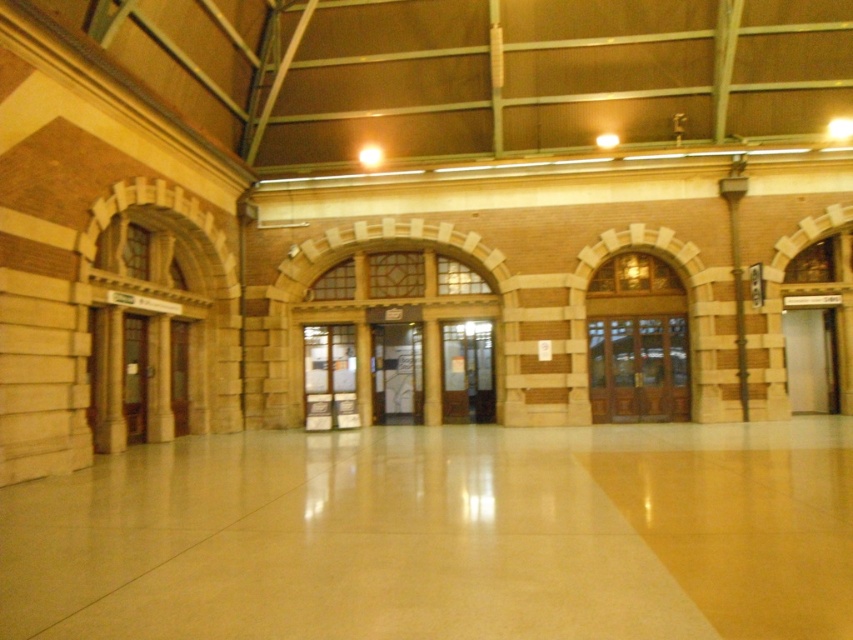
Is satin silver door at right in front of wooden door at left?

No, it is not.

Does satin silver door at right appear on the right side of wooden door at left?

Correct, you'll find satin silver door at right to the right of wooden door at left.

Which is behind, point (782, 310) or point (142, 346)?

The point (782, 310) is more distant.

Where is `satin silver door at right`? The image size is (853, 640). satin silver door at right is located at coordinates (810, 358).

Does wooden door at center have a lesser width compared to transparent glass door at center?

Yes.

Can you confirm if wooden door at center is wider than transparent glass door at center?

No.

Is point (468, 378) closer to viewer compared to point (404, 340)?

Yes, it is in front of point (404, 340).

Identify the location of wooden door at center. The image size is (853, 640). (467, 371).

Can you confirm if satin silver door at right is smaller than wooden door at center?

Incorrect, satin silver door at right is not smaller in size than wooden door at center.

How distant is satin silver door at right from wooden door at center?

A distance of 9.28 meters exists between satin silver door at right and wooden door at center.

Measure the distance between satin silver door at right and camera.

satin silver door at right is 19.45 meters away from camera.

Where is `satin silver door at right`? Image resolution: width=853 pixels, height=640 pixels. satin silver door at right is located at coordinates (810, 358).